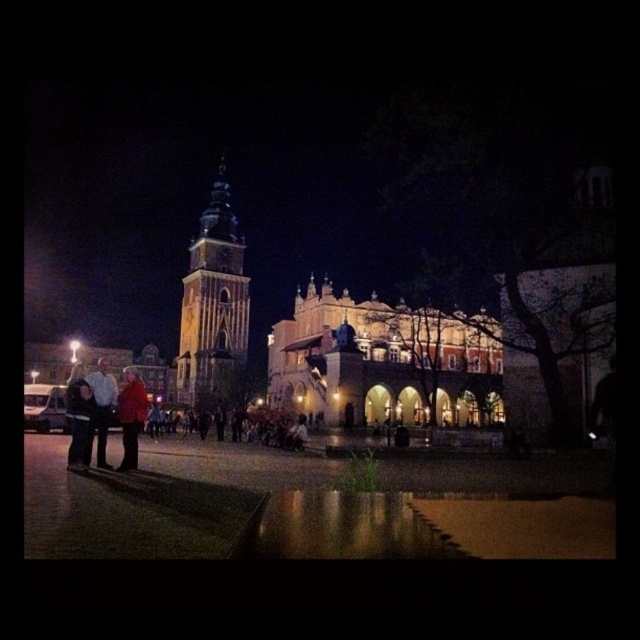
Does blue glass bell tower at center have a greater height compared to red wool coat at center?

Yes, blue glass bell tower at center is taller than red wool coat at center.

Between blue glass bell tower at center and red wool coat at center, which one has more height?

Standing taller between the two is blue glass bell tower at center.

Find the location of a particular element. The image size is (640, 640). blue glass bell tower at center is located at coordinates (212, 304).

Which is behind, point (390, 403) or point (214, 340)?

Point (214, 340)

Is brick building at center shorter than blue glass bell tower at center?

In fact, brick building at center may be taller than blue glass bell tower at center.

Looking at this image, who is more distant from viewer, (164, 452) or (232, 333)?

Positioned behind is point (232, 333).

You are a GUI agent. You are given a task and a screenshot of the screen. Output one action in this format:
    pyautogui.click(x=<x>, y=<y>)
    Task: Click on the brick building at center
    The image size is (640, 640).
    Given the screenshot: What is the action you would take?
    pyautogui.click(x=310, y=506)

Consider the image. Does brick building at center have a lesser width compared to red wool coat at center?

No.

Who is more distant from viewer, (x=218, y=224) or (x=141, y=412)?

The point (x=218, y=224) is behind.

I want to click on brick building at center, so click(x=310, y=506).